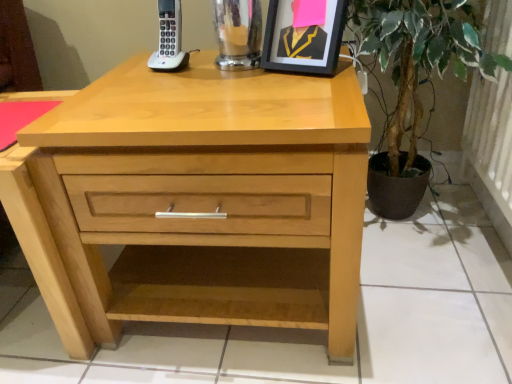
Question: Is natural wood chest of drawers at center oriented away from green leafy plant at right?

Choices:
 (A) yes
 (B) no

Answer: (B)

Question: Would you say natural wood chest of drawers at center is outside green leafy plant at right?

Choices:
 (A) no
 (B) yes

Answer: (B)

Question: Can you confirm if natural wood chest of drawers at center is bigger than green leafy plant at right?

Choices:
 (A) no
 (B) yes

Answer: (A)

Question: Would you say green leafy plant at right is part of natural wood chest of drawers at center's contents?

Choices:
 (A) yes
 (B) no

Answer: (B)

Question: From the image's perspective, is natural wood chest of drawers at center located beneath green leafy plant at right?

Choices:
 (A) yes
 (B) no

Answer: (A)

Question: Does natural wood chest of drawers at center have a greater width compared to green leafy plant at right?

Choices:
 (A) yes
 (B) no

Answer: (A)

Question: Is natural wood chest of drawers at center at the right side of black matte picture frame at upper center?

Choices:
 (A) yes
 (B) no

Answer: (B)

Question: Is natural wood chest of drawers at center completely or partially outside of black matte picture frame at upper center?

Choices:
 (A) no
 (B) yes

Answer: (B)

Question: Is the position of natural wood chest of drawers at center less distant than that of black matte picture frame at upper center?

Choices:
 (A) yes
 (B) no

Answer: (A)

Question: Does natural wood chest of drawers at center appear on the left side of black matte picture frame at upper center?

Choices:
 (A) yes
 (B) no

Answer: (A)

Question: From the image's perspective, does natural wood chest of drawers at center appear lower than black matte picture frame at upper center?

Choices:
 (A) yes
 (B) no

Answer: (A)

Question: Does natural wood chest of drawers at center have a greater width compared to black matte picture frame at upper center?

Choices:
 (A) no
 (B) yes

Answer: (B)

Question: Can you confirm if black matte picture frame at upper center is smaller than natural wood chest of drawers at center?

Choices:
 (A) no
 (B) yes

Answer: (B)